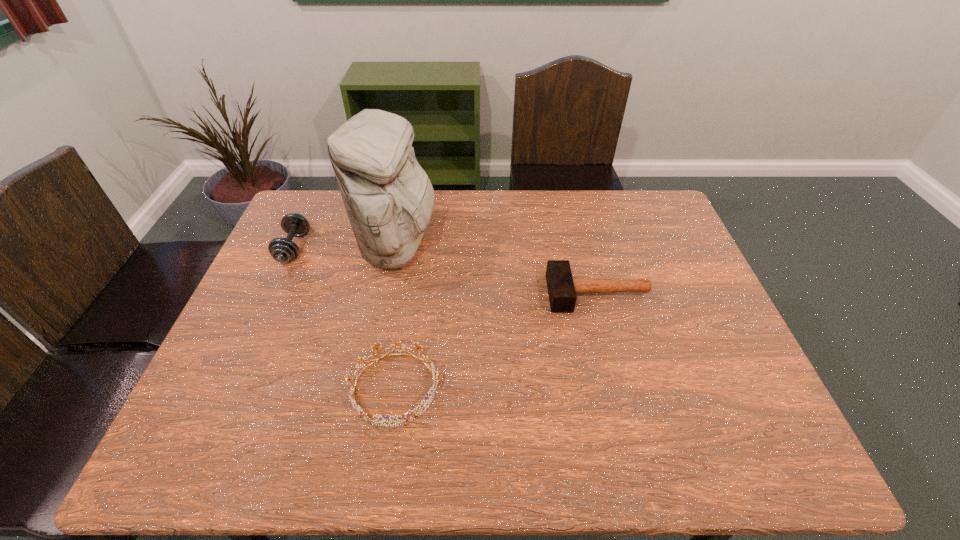
The image size is (960, 540). I want to click on vacant position located 0.130m on the hammer head face of the mallet, so click(x=502, y=293).

The height and width of the screenshot is (540, 960). What are the coordinates of `backpack situated at the far edge` in the screenshot? It's located at (388, 197).

The width and height of the screenshot is (960, 540). Identify the location of dumbbell at the far edge. (283, 250).

Where is `object positioned at the near edge`? This screenshot has height=540, width=960. object positioned at the near edge is located at coordinates (362, 414).

This screenshot has width=960, height=540. I want to click on object at the left edge, so click(x=283, y=250).

Find the location of a particular element. The image size is (960, 540). object that is at the far left corner is located at coordinates (283, 250).

The image size is (960, 540). In the image, there is a desktop. Find the location of `vacant space at the far edge`. vacant space at the far edge is located at coordinates (565, 214).

Identify the location of free space at the near edge of the desktop. click(368, 444).

The height and width of the screenshot is (540, 960). I want to click on free spot at the left edge of the desktop, so click(x=222, y=411).

In the image, there is a desktop. Where is `free space at the right edge`? The height and width of the screenshot is (540, 960). free space at the right edge is located at coordinates (658, 269).